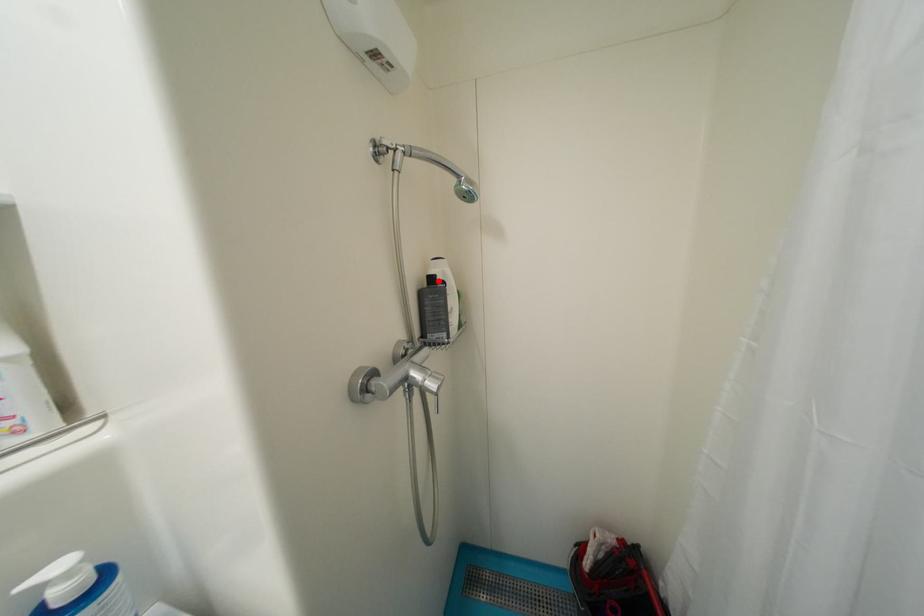
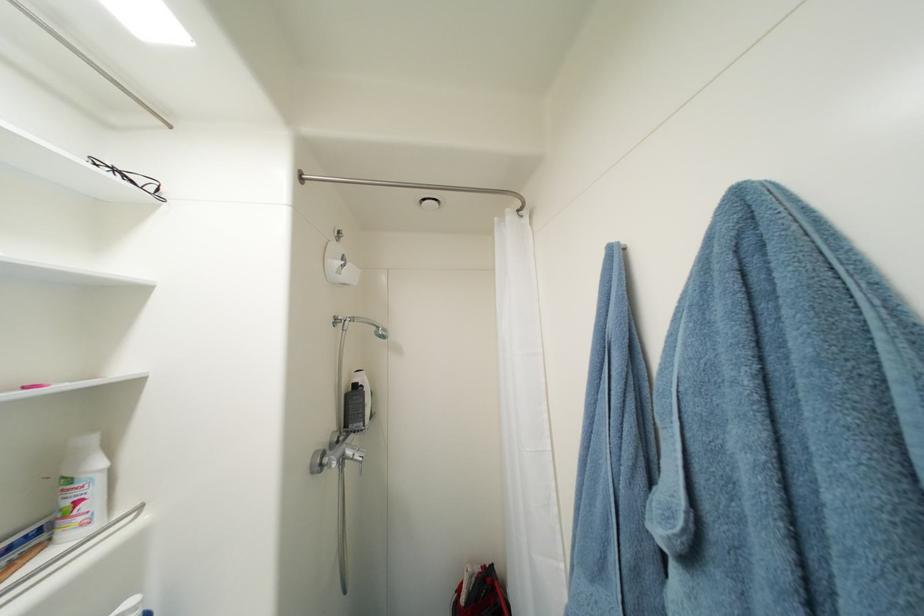
Where in the second image is the point corresponding to the highlighted location from the first image?

(361, 387)